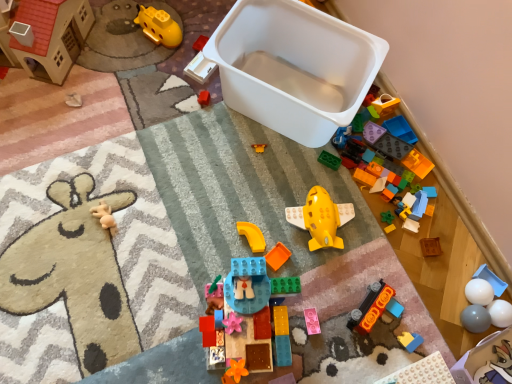
Locate an element on the screen. The image size is (512, 384). free spot to the right of yellow plastic submarine at upper left, which ranks as the fourteenth toy in right-to-left order is located at coordinates (200, 48).